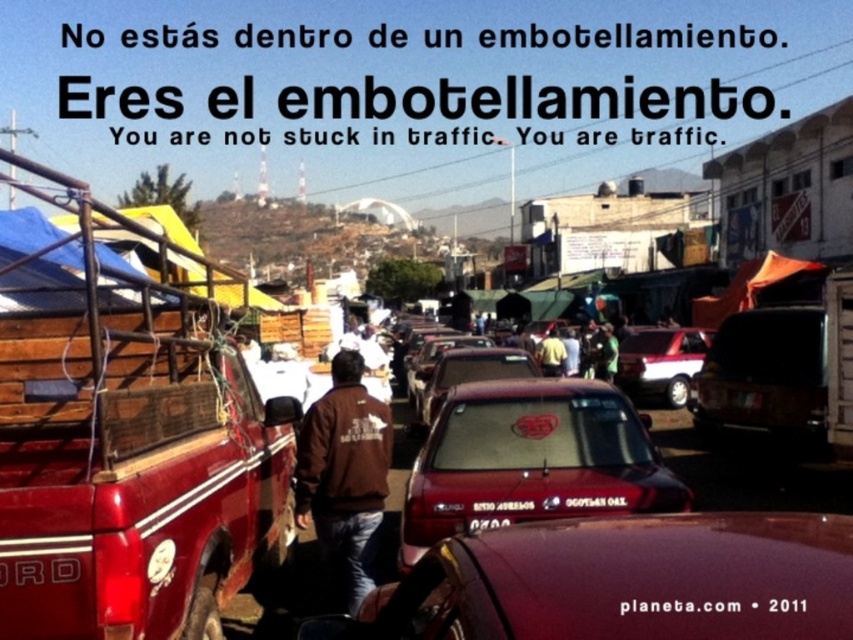
Question: Based on their relative distances, which object is farther from the brown leather jacket at center?

Choices:
 (A) metallic silver car at center
 (B) matte red truck at left

Answer: (A)

Question: Can you confirm if matte red truck at left is positioned above shiny black car at center?

Choices:
 (A) yes
 (B) no

Answer: (A)

Question: Estimate the real-world distances between objects in this image. Which object is farther from the satin brown car at center?

Choices:
 (A) metallic silver car at center
 (B) metallic red car at center

Answer: (B)

Question: Can you confirm if matte red truck at left is bigger than shiny red car at center?

Choices:
 (A) yes
 (B) no

Answer: (A)

Question: Is shiny red car at center positioned before metallic silver car at center?

Choices:
 (A) no
 (B) yes

Answer: (B)

Question: Which point appears farthest from the camera in this image?

Choices:
 (A) (424, 556)
 (B) (544, 516)

Answer: (B)